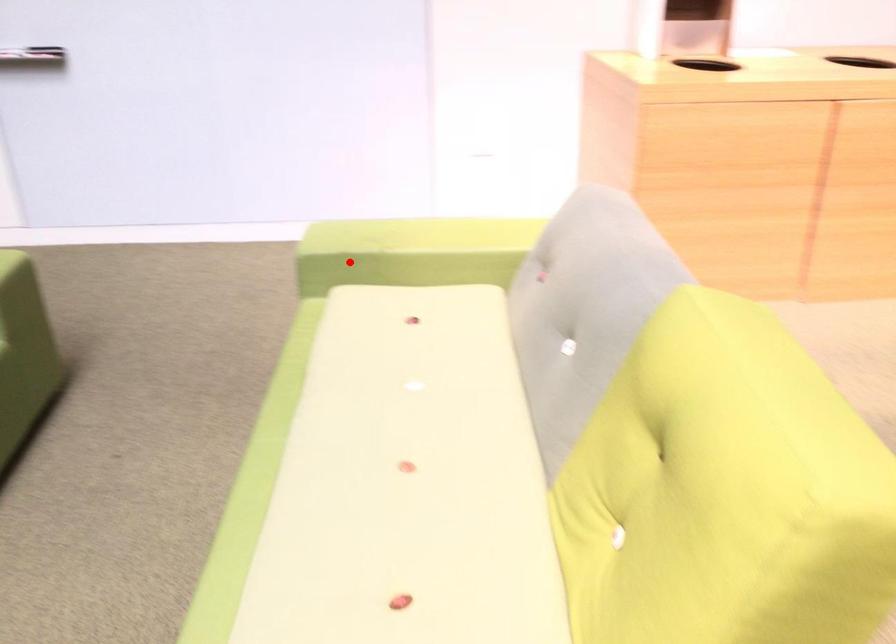
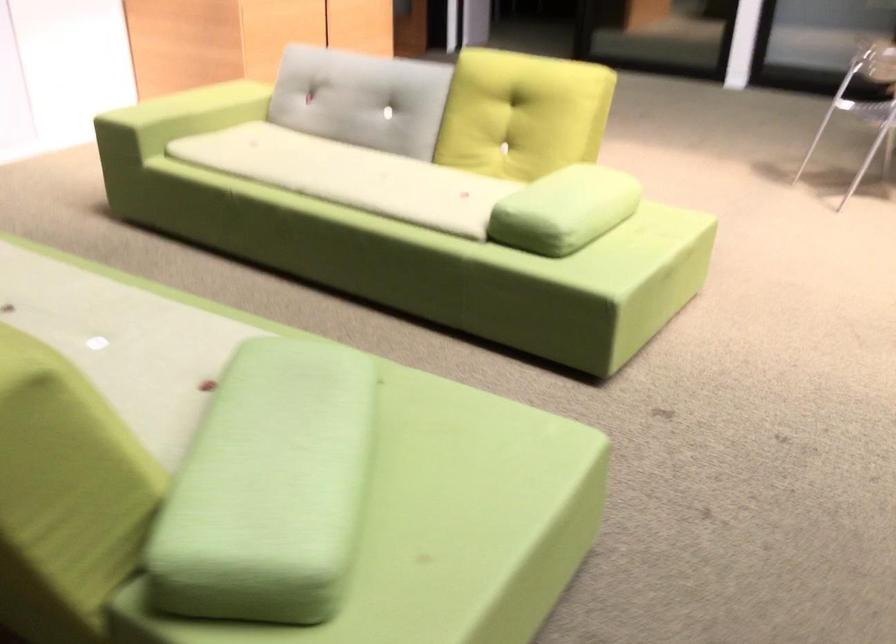
The point at the highlighted location is marked in the first image. Where is the corresponding point in the second image?

(178, 117)